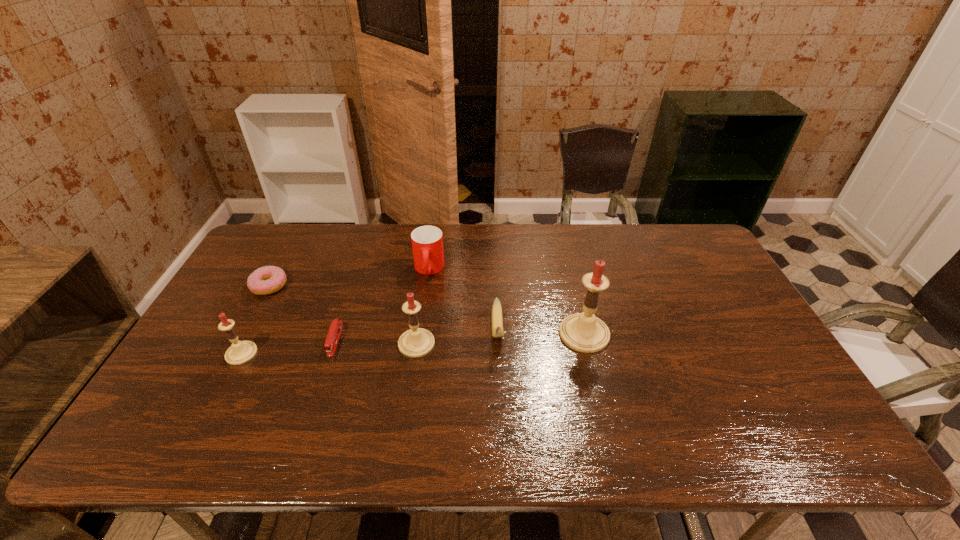
I want to click on free region at the far edge of the desktop, so click(654, 255).

Identify the location of vacant space at the near edge. Image resolution: width=960 pixels, height=540 pixels. 635,387.

Locate an element on the screen. The image size is (960, 540). vacant space at the left edge of the desktop is located at coordinates (228, 298).

Locate an element on the screen. The height and width of the screenshot is (540, 960). free space at the right edge of the desktop is located at coordinates (700, 319).

You are a GUI agent. You are given a task and a screenshot of the screen. Output one action in this format:
    pyautogui.click(x=<x>, y=<y>)
    Task: Click on the free space at the far right corner
    This screenshot has width=960, height=540.
    Given the screenshot: What is the action you would take?
    (x=694, y=250)

The image size is (960, 540). In order to click on vacant space at the near right corner in this screenshot , I will do `click(792, 386)`.

The height and width of the screenshot is (540, 960). Identify the location of vacant space that is in between the fourth shortest object and the second tallest object. (422, 307).

You are a GUI agent. You are given a task and a screenshot of the screen. Output one action in this format:
    pyautogui.click(x=<x>, y=<y>)
    Task: Click on the vacant area that lies between the fourth tallest object and the stapler
    The width and height of the screenshot is (960, 540).
    Given the screenshot: What is the action you would take?
    pyautogui.click(x=382, y=305)

Where is `vacant area between the doughnut and the rightmost object`? Image resolution: width=960 pixels, height=540 pixels. vacant area between the doughnut and the rightmost object is located at coordinates (426, 310).

At what (x,y) coordinates should I click in order to perform the action: click on vacant area that lies between the second candle from right to left and the rightmost object. Please return your answer as a coordinate pair (x, y). This screenshot has height=540, width=960. Looking at the image, I should click on (500, 339).